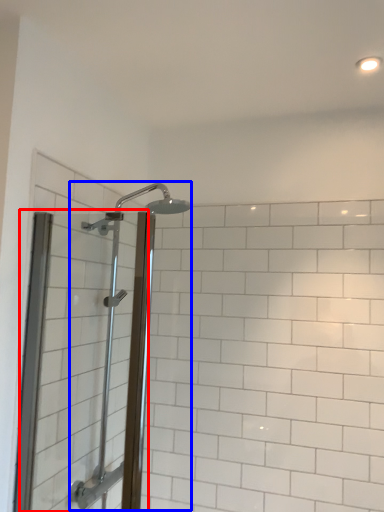
Question: Which of the following is the farthest to the observer, screen door (highlighted by a red box) or shower (highlighted by a blue box)?

Choices:
 (A) screen door
 (B) shower

Answer: (B)